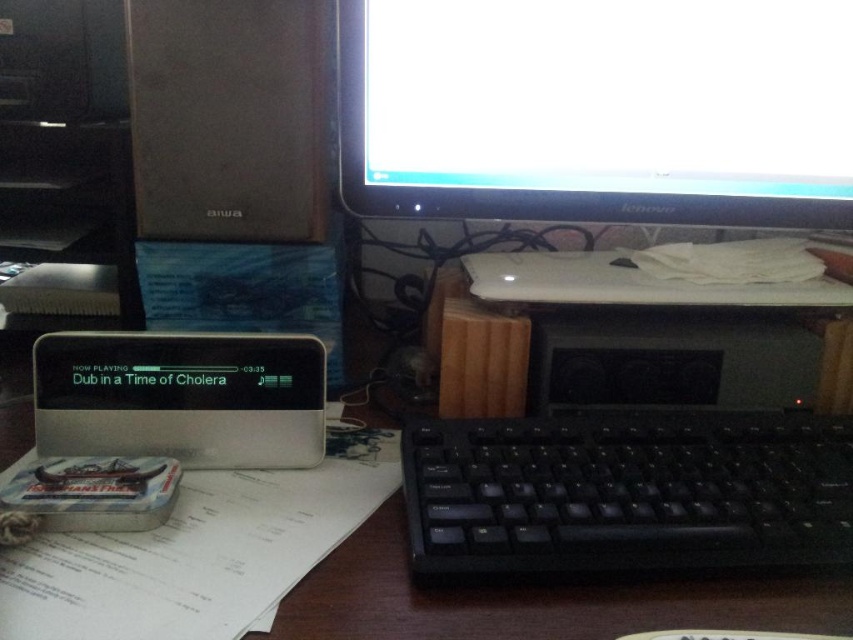
What are the coordinates of the black glossy monitor at upper center?

The coordinates of the black glossy monitor at upper center are 0.173 in the x axis and 0.701 in the y axis.

You are standing in front of the desk and want to reach two points on the desk. The first point is at coordinates point (413, 438) and the second point is at coordinates point (4, 445). Which point is closer to you?

Point (413, 438) is closer to the viewer than point (4, 445).